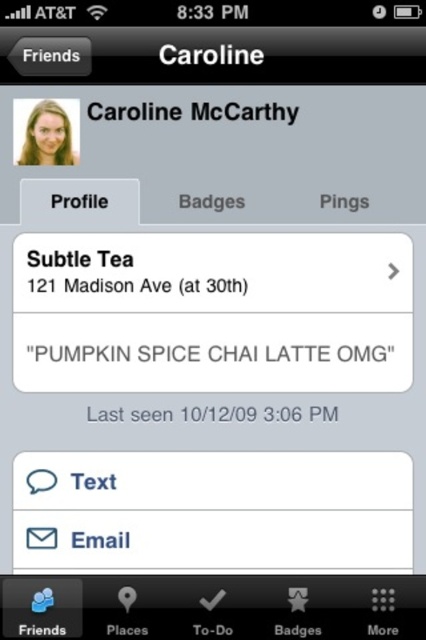
You are holding a smartphone with this app open and want to take a screenshot of the matte plastic cup at center. The app requires you to be exactly 1.5 meters away from the object to capture it properly. Can you take the screenshot as required?

The matte plastic cup at center is 1.39 meters away from the camera, which is closer than the required 1.5 meters. Therefore, you need to move back slightly to ensure the distance is exactly 1.5 meters before taking the screenshot.

Consider the image. You are designing a mobile app interface and need to ensure accessibility for users with visual impairments. The matte plastic cup at center and the matte blonde hair at upper left are critical elements for navigation. Given that the minimum recommended spacing between interactive elements for accessibility is 12 inches, is the current spacing between these two elements sufficient?

The matte plastic cup at center and the matte blonde hair at upper left are 11.15 inches apart from each other. Since the minimum recommended spacing for accessibility is 12 inches, the current spacing is insufficient and does not meet accessibility standards.